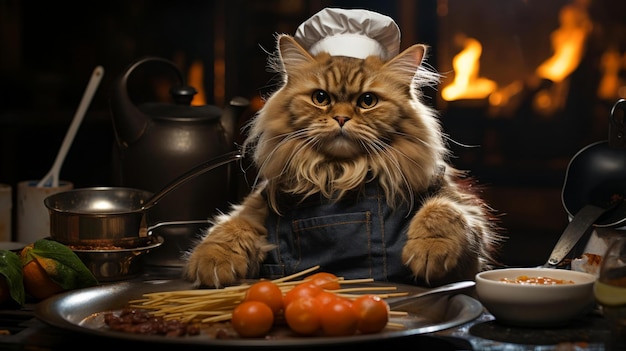
Where is `bowl`? The height and width of the screenshot is (351, 626). bowl is located at coordinates (526, 296).